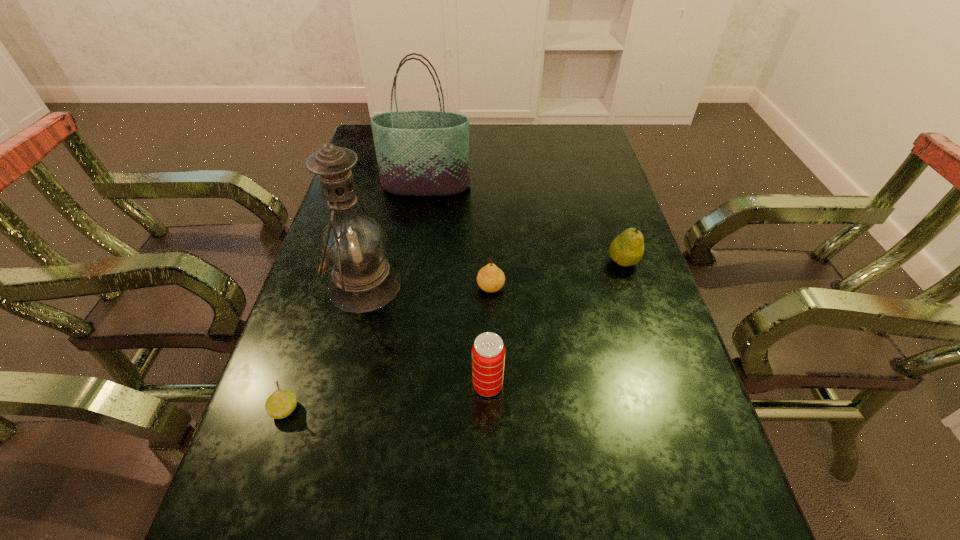
The width and height of the screenshot is (960, 540). I want to click on pear that is the second closest to the oil lamp, so click(490, 278).

You are a GUI agent. You are given a task and a screenshot of the screen. Output one action in this format:
    pyautogui.click(x=<x>, y=<y>)
    Task: Click on the vacant space that satisfies the following two spatial constraints: 1. on the back side of the oil lamp; 2. on the right side of the tote bag
    
    Given the screenshot: What is the action you would take?
    pyautogui.click(x=389, y=186)

This screenshot has height=540, width=960. Identify the location of free space that satisfies the following two spatial constraints: 1. on the back side of the oil lamp; 2. on the right side of the farthest pear. (371, 261).